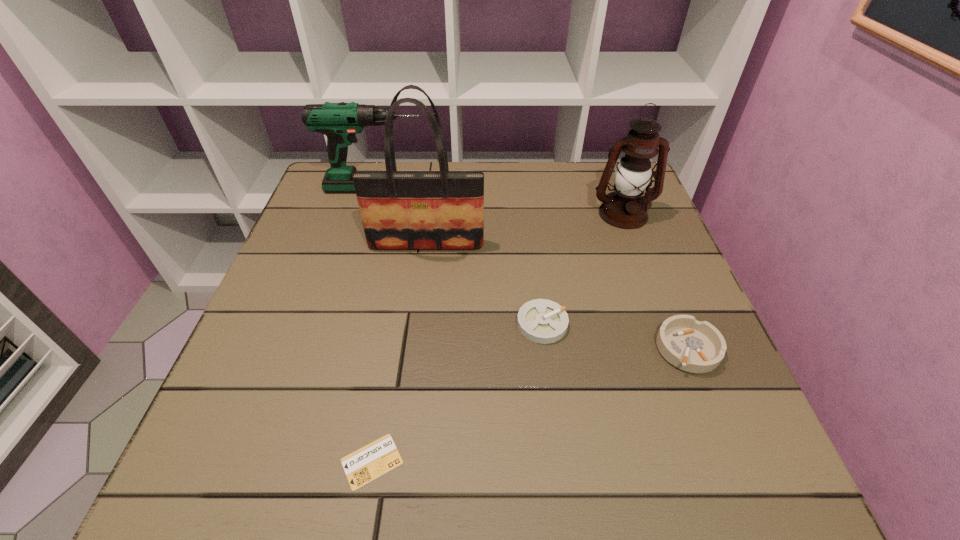
Locate an element on the screen. This screenshot has height=540, width=960. free space at the near right corner of the desktop is located at coordinates (749, 470).

Locate an element on the screen. This screenshot has height=540, width=960. free space between the fifth shortest object and the third tallest object is located at coordinates (499, 201).

This screenshot has height=540, width=960. What are the coordinates of `free space that is in between the nearest object and the fifth tallest object` in the screenshot? It's located at point(457,393).

This screenshot has width=960, height=540. Find the location of `free space between the fifth shortest object and the nearest object`. free space between the fifth shortest object and the nearest object is located at coordinates (497, 338).

At what (x,y) coordinates should I click in order to perform the action: click on vacant area that lies between the third shortest object and the lantern. Please return your answer as a coordinate pair (x, y). The height and width of the screenshot is (540, 960). Looking at the image, I should click on (656, 281).

Identify the location of vacant area that lies between the second farthest object and the left ashtray. The height and width of the screenshot is (540, 960). (583, 269).

I want to click on vacant region between the fourth shortest object and the identity card, so click(373, 325).

Locate an element on the screen. blank region between the shorter ashtray and the nearest object is located at coordinates (457, 393).

Where is `free space between the taller ashtray and the tallest object`? The image size is (960, 540). free space between the taller ashtray and the tallest object is located at coordinates coord(557,296).

At what (x,y) coordinates should I click in order to perform the action: click on object that stands as the fifth closest to the third tallest object. Please return your answer as a coordinate pair (x, y). Looking at the image, I should click on (370, 462).